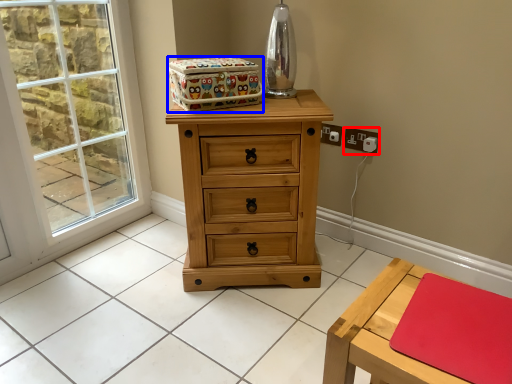
Question: Among these objects, which one is farthest to the camera, electric outlet (highlighted by a red box) or storage box (highlighted by a blue box)?

Choices:
 (A) electric outlet
 (B) storage box

Answer: (A)